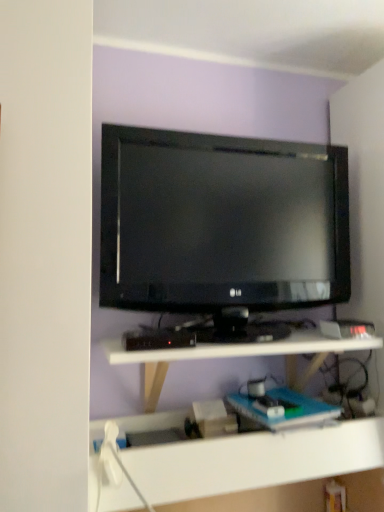
Question: Is black glossy tv at center turned away from white plastic shelf at lower center?

Choices:
 (A) yes
 (B) no

Answer: (B)

Question: From a real-world perspective, is black glossy tv at center physically below white plastic shelf at lower center?

Choices:
 (A) no
 (B) yes

Answer: (A)

Question: Does black glossy tv at center lie behind white plastic shelf at lower center?

Choices:
 (A) no
 (B) yes

Answer: (B)

Question: Does black glossy tv at center turn towards white plastic shelf at lower center?

Choices:
 (A) no
 (B) yes

Answer: (A)

Question: From a real-world perspective, does black glossy tv at center stand above white plastic shelf at lower center?

Choices:
 (A) no
 (B) yes

Answer: (B)

Question: Is black glossy tv at center at the left side of white plastic shelf at lower center?

Choices:
 (A) no
 (B) yes

Answer: (A)

Question: Is white plastic shelf at lower center smaller than black glossy tv at center?

Choices:
 (A) yes
 (B) no

Answer: (B)

Question: Considering the relative positions of white plastic shelf at lower center and black glossy tv at center in the image provided, is white plastic shelf at lower center to the left of black glossy tv at center from the viewer's perspective?

Choices:
 (A) no
 (B) yes

Answer: (B)

Question: Can we say white plastic shelf at lower center lies outside black glossy tv at center?

Choices:
 (A) yes
 (B) no

Answer: (A)

Question: Does white plastic shelf at lower center come behind black glossy tv at center?

Choices:
 (A) yes
 (B) no

Answer: (B)

Question: Is white plastic shelf at lower center wider than black glossy tv at center?

Choices:
 (A) no
 (B) yes

Answer: (B)

Question: Considering the relative sizes of white plastic shelf at lower center and black glossy tv at center in the image provided, is white plastic shelf at lower center taller than black glossy tv at center?

Choices:
 (A) no
 (B) yes

Answer: (A)

Question: Looking at their shapes, would you say white plastic shelf at lower center is wider or thinner than black glossy tv at center?

Choices:
 (A) thin
 (B) wide

Answer: (B)